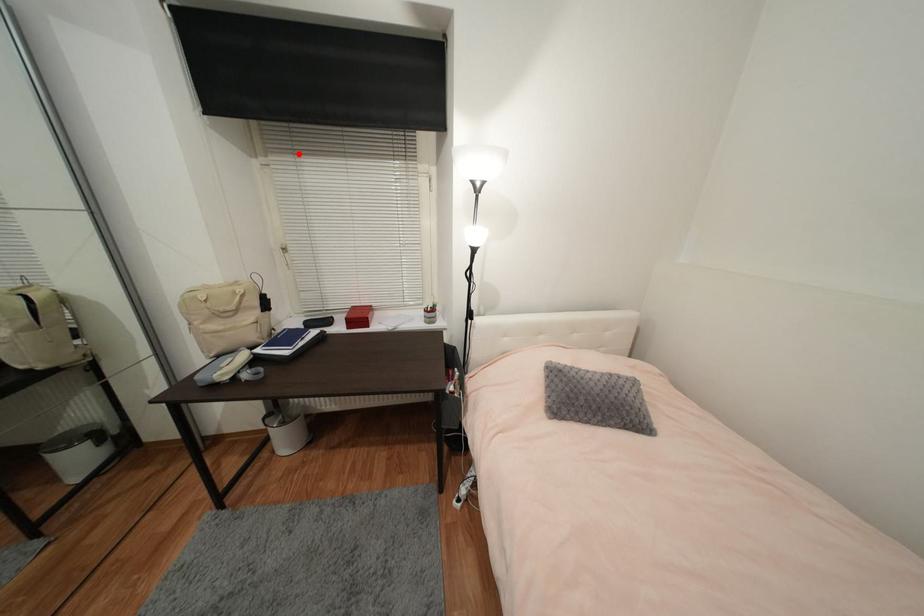
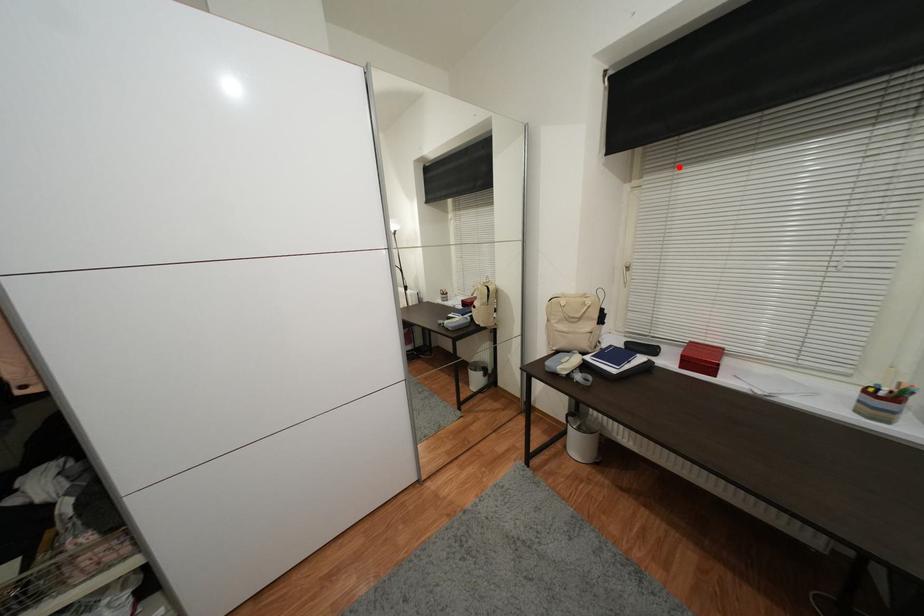
I am providing you with two images of the same scene from different viewpoints. A red point is marked on the first image and another point is marked on the second image. Does the point marked in image1 correspond to the same location as the one in image2?

Yes